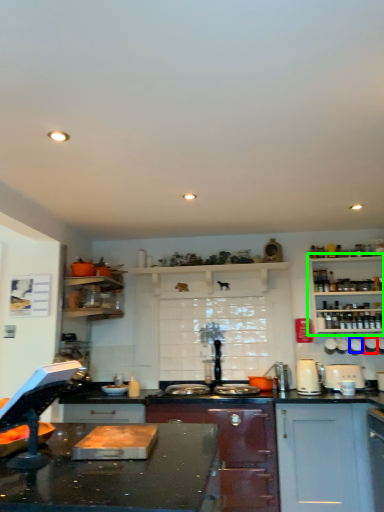
Question: Based on their relative distances, which object is farther from appliance (highlighted by a red box)? Choose from appliance (highlighted by a blue box) and shelf (highlighted by a green box).

Choices:
 (A) appliance
 (B) shelf

Answer: (B)